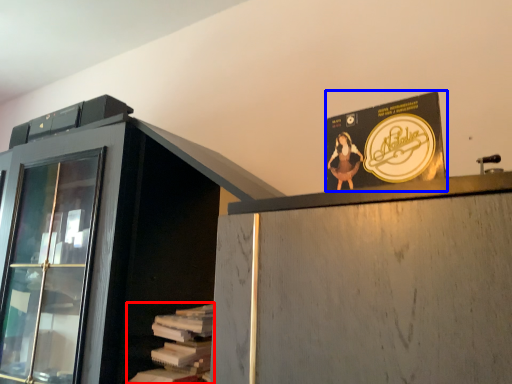
Question: Which object appears farthest to the camera in this image, book (highlighted by a red box) or advertisement (highlighted by a blue box)?

Choices:
 (A) book
 (B) advertisement

Answer: (A)